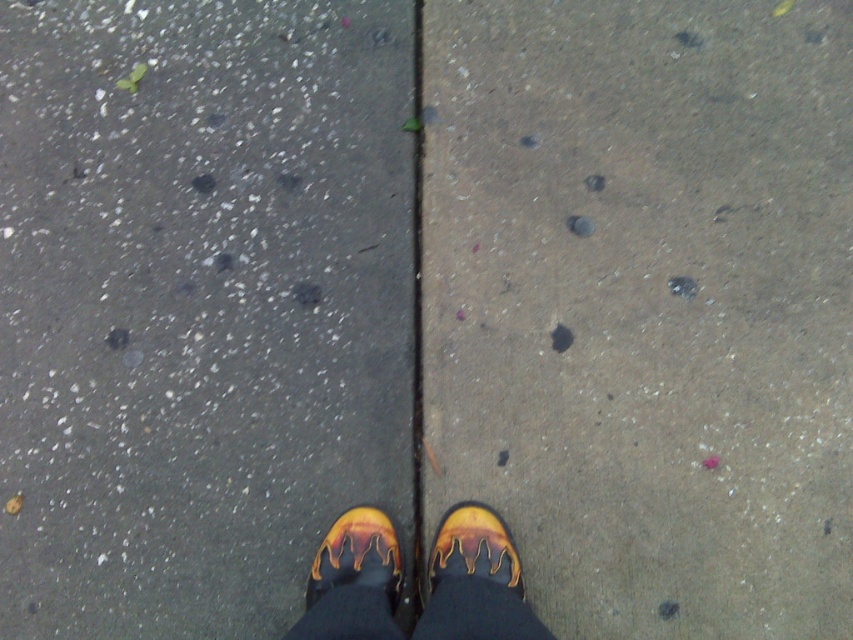
In the scene shown: Is yellow rubber boots at center to the left of yellow rubber shoe at center from the viewer's perspective?

No, yellow rubber boots at center is not to the left of yellow rubber shoe at center.

Can you confirm if yellow rubber boots at center is bigger than yellow rubber shoe at center?

Yes, yellow rubber boots at center is bigger than yellow rubber shoe at center.

Based on the photo, who is more forward, [469,504] or [350,531]?

Positioned in front is point [350,531].

Locate an element on the screen. The image size is (853, 640). yellow rubber boots at center is located at coordinates (474, 580).

At what (x,y) coordinates should I click in order to perform the action: click on smooth asphalt at left. Please return your answer as a coordinate pair (x, y). Looking at the image, I should click on (196, 305).

In the scene shown: Is smooth asphalt at left further to camera compared to yellow rubber boots at center?

Yes.

Which is in front, point (144, 268) or point (502, 621)?

Point (502, 621) is more forward.

Find the location of a particular element. smooth asphalt at left is located at coordinates (196, 305).

Which is above, concrete at center or yellow rubber shoe at lower center?

concrete at center is higher up.

Based on the photo, is concrete at center positioned in front of yellow rubber shoe at lower center?

No, it is behind yellow rubber shoe at lower center.

Does point (570, 280) come farther from viewer compared to point (485, 557)?

Yes, point (570, 280) is behind point (485, 557).

Where is `concrete at center`? This screenshot has height=640, width=853. concrete at center is located at coordinates (645, 305).